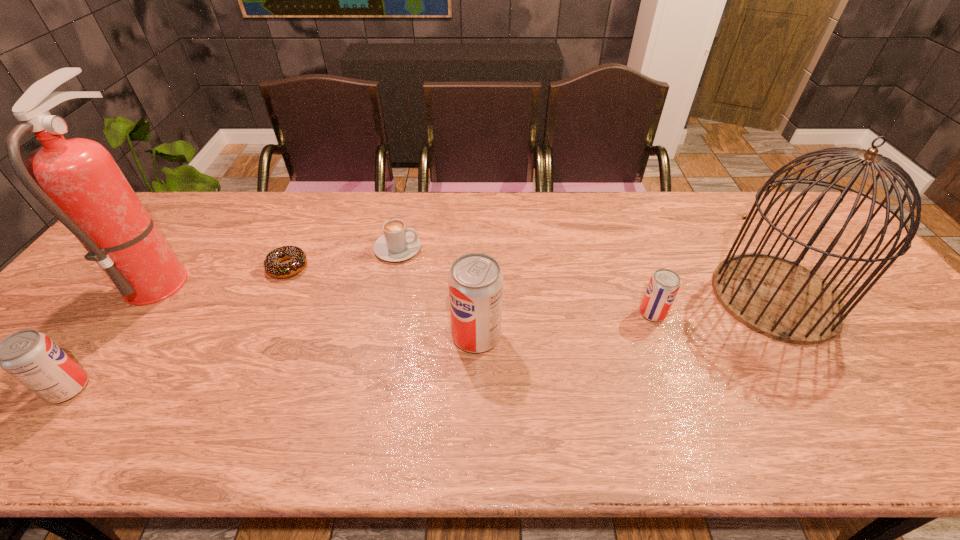
This screenshot has height=540, width=960. Find the location of `fire extinguisher`. fire extinguisher is located at coordinates (77, 180).

Locate an element on the screen. birdcage is located at coordinates (778, 298).

At what (x,y) coordinates should I click in order to perform the action: click on vacant region located on the right of the nearest object. Please return your answer as a coordinate pair (x, y). This screenshot has height=540, width=960. Looking at the image, I should click on (180, 388).

This screenshot has width=960, height=540. In order to click on vacant space located 0.310m on the left of the fifth shortest object in this screenshot , I will do `click(326, 335)`.

Image resolution: width=960 pixels, height=540 pixels. I want to click on free space located on the front of the shortest soda, so click(x=666, y=349).

Locate an element on the screen. blank area located to the right of the sixth tallest object is located at coordinates (497, 248).

You are a GUI agent. You are given a task and a screenshot of the screen. Output one action in this format:
    pyautogui.click(x=<x>, y=<y>)
    Task: Click on the vacant region located 0.090m on the back of the shortest object
    The image size is (960, 540).
    Given the screenshot: What is the action you would take?
    pyautogui.click(x=302, y=234)

Where is `vacant space situated with the handle and hose on the fire extinguisher`? vacant space situated with the handle and hose on the fire extinguisher is located at coordinates (253, 278).

The width and height of the screenshot is (960, 540). Identify the location of vacant space located at the door of the birdcage. (648, 296).

Locate an element on the screen. blank space located at the door of the birdcage is located at coordinates (578, 296).